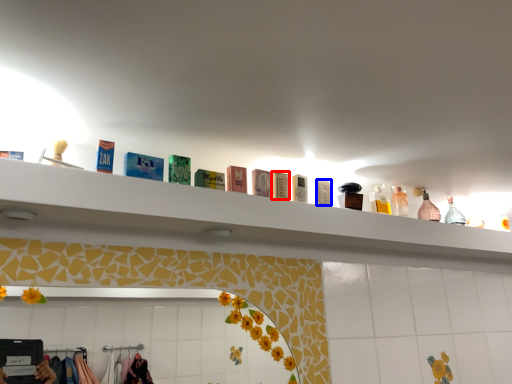
Question: Which object is closer to the camera taking this photo, toiletry (highlighted by a red box) or toiletry (highlighted by a blue box)?

Choices:
 (A) toiletry
 (B) toiletry

Answer: (A)